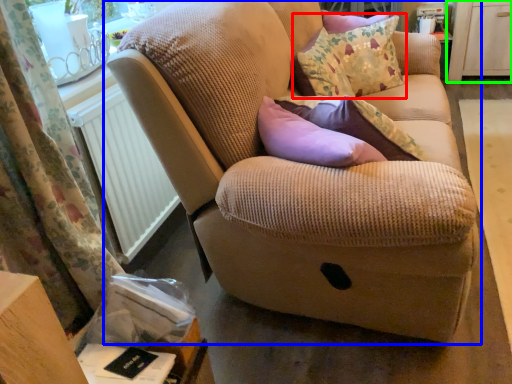
Question: Which is nearer to the throw pillow (highlighted by a red box)? studio couch (highlighted by a blue box) or dresser (highlighted by a green box).

Choices:
 (A) studio couch
 (B) dresser

Answer: (A)